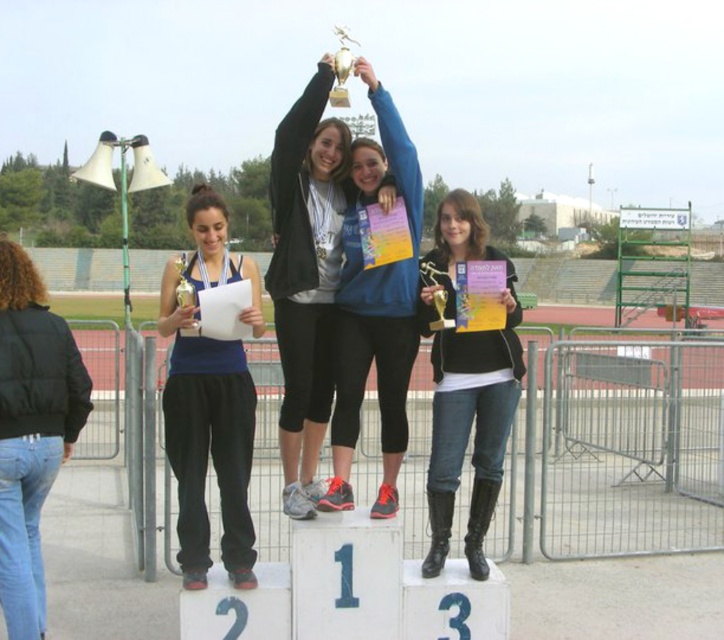
Does point (181, 424) lie behind point (442, 314)?

No, (181, 424) is in front of (442, 314).

Looking at this image, can you confirm if matte blue tank top at left is thinner than gold metallic trophy at center?

No, matte blue tank top at left is not thinner than gold metallic trophy at center.

Does point (240, 436) come farther from viewer compared to point (439, 275)?

No, (240, 436) is in front of (439, 275).

The width and height of the screenshot is (724, 640). Identify the location of matte blue tank top at left. (209, 401).

Is point (295, 333) positioned before point (429, 273)?

Yes.

Is matte black jacket at center positioned behind gold metallic trophy at center?

No, matte black jacket at center is closer to the viewer.

This screenshot has height=640, width=724. In order to click on matte black jacket at center in this screenshot , I will do `click(306, 276)`.

Find the location of a particular element. The height and width of the screenshot is (640, 724). matte black jacket at center is located at coordinates (306, 276).

Is matte blue tank top at left to the right of black puffy jacket at lower left from the viewer's perspective?

Indeed, matte blue tank top at left is positioned on the right side of black puffy jacket at lower left.

Is matte blue tank top at left to the left of black puffy jacket at lower left from the viewer's perspective?

Incorrect, matte blue tank top at left is not on the left side of black puffy jacket at lower left.

The height and width of the screenshot is (640, 724). What do you see at coordinates (209, 401) in the screenshot?
I see `matte blue tank top at left` at bounding box center [209, 401].

Identify the location of matte blue tank top at left. Image resolution: width=724 pixels, height=640 pixels. (209, 401).